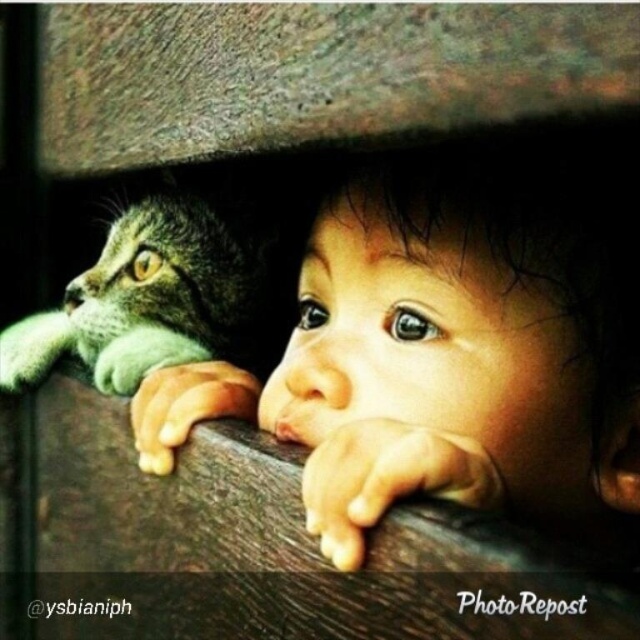
Question: Which point appears closest to the camera in this image?

Choices:
 (A) (115, 356)
 (B) (326, 368)

Answer: (B)

Question: Considering the relative positions of smooth skin baby at center and tabby fur cat at left in the image provided, where is smooth skin baby at center located with respect to tabby fur cat at left?

Choices:
 (A) right
 (B) left

Answer: (A)

Question: Which object appears closest to the camera in this image?

Choices:
 (A) smooth skin baby at center
 (B) tabby fur cat at left

Answer: (A)

Question: Is smooth skin baby at center wider than tabby fur cat at left?

Choices:
 (A) no
 (B) yes

Answer: (A)

Question: Can you confirm if smooth skin baby at center is positioned below tabby fur cat at left?

Choices:
 (A) no
 (B) yes

Answer: (B)